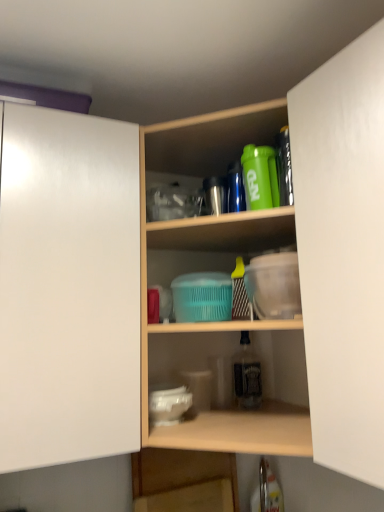
Describe the element at coordinates (213, 269) in the screenshot. I see `wooden shelves at center, the first shelf viewed from the top` at that location.

Image resolution: width=384 pixels, height=512 pixels. I want to click on clear glass bottle at center, which is the 2th bottle from front to back, so click(247, 375).

Image resolution: width=384 pixels, height=512 pixels. What do you see at coordinates (247, 375) in the screenshot?
I see `clear glass bottle at center, which is the 2th bottle from front to back` at bounding box center [247, 375].

This screenshot has height=512, width=384. I want to click on white matte cabinet door at left, marked as the 2th cabinetry in a right-to-left arrangement, so click(68, 288).

Is wooden shelves at center, marked as the second shelf in a bottom-to-top arrangement, placed right next to white matte cabinet door at left, positioned as the 1th cabinetry in left-to-right order?

No, wooden shelves at center, marked as the second shelf in a bottom-to-top arrangement, is not touching white matte cabinet door at left, positioned as the 1th cabinetry in left-to-right order.

From the image's perspective, is wooden shelves at center, marked as the second shelf in a bottom-to-top arrangement, located above or below white matte cabinet door at left, positioned as the 1th cabinetry in left-to-right order?

From the image's perspective, wooden shelves at center, marked as the second shelf in a bottom-to-top arrangement, appears below white matte cabinet door at left, positioned as the 1th cabinetry in left-to-right order.

Considering the sizes of objects wooden shelves at center, the first shelf viewed from the top, and white matte cabinet door at left, positioned as the 1th cabinetry in left-to-right order, in the image provided, who is thinner, wooden shelves at center, the first shelf viewed from the top, or white matte cabinet door at left, positioned as the 1th cabinetry in left-to-right order,?

white matte cabinet door at left, positioned as the 1th cabinetry in left-to-right order.

Is wooden shelves at center, the first shelf viewed from the top, positioned behind white matte cabinet door at left, positioned as the 1th cabinetry in left-to-right order?

Yes, wooden shelves at center, the first shelf viewed from the top, is further from the viewer.

Is white matte cabinet door at left, marked as the 2th cabinetry in a right-to-left arrangement, bigger or smaller than clear glass bottle at center, the 2th bottle viewed from the top?

Considering their sizes, white matte cabinet door at left, marked as the 2th cabinetry in a right-to-left arrangement, takes up more space than clear glass bottle at center, the 2th bottle viewed from the top.

From a real-world perspective, is white matte cabinet door at left, marked as the 2th cabinetry in a right-to-left arrangement, located beneath clear glass bottle at center, marked as the 1th bottle in a bottom-to-top arrangement?

Actually, white matte cabinet door at left, marked as the 2th cabinetry in a right-to-left arrangement, is physically above clear glass bottle at center, marked as the 1th bottle in a bottom-to-top arrangement, in the real world.

Could you tell me if white matte cabinet door at left, marked as the 2th cabinetry in a right-to-left arrangement, is turned towards clear glass bottle at center, which is counted as the first bottle, starting from the back?

No, white matte cabinet door at left, marked as the 2th cabinetry in a right-to-left arrangement, is not oriented towards clear glass bottle at center, which is counted as the first bottle, starting from the back.

In the image, is white matte cabinet door at left, marked as the 2th cabinetry in a right-to-left arrangement, positioned in front of or behind clear glass bottle at center, which is the 2th bottle from front to back?

Clearly, white matte cabinet door at left, marked as the 2th cabinetry in a right-to-left arrangement, is in front of clear glass bottle at center, which is the 2th bottle from front to back.

Is wooden shelves at center, the first shelf viewed from the top, wider or thinner than wooden shelf at lower center, positioned as the 1th shelf in bottom-to-top order?

Clearly, wooden shelves at center, the first shelf viewed from the top, has more width compared to wooden shelf at lower center, positioned as the 1th shelf in bottom-to-top order.

Is wooden shelves at center, the first shelf viewed from the top, at the right side of wooden shelf at lower center, positioned as the 1th shelf in bottom-to-top order?

Correct, you'll find wooden shelves at center, the first shelf viewed from the top, to the right of wooden shelf at lower center, positioned as the 1th shelf in bottom-to-top order.

Is wooden shelves at center, marked as the second shelf in a bottom-to-top arrangement, not within wooden shelf at lower center, the second shelf viewed from the top?

Yes.

Is wooden shelves at center, the first shelf viewed from the top, oriented away from wooden shelf at lower center, positioned as the 1th shelf in bottom-to-top order?

No, wooden shelf at lower center, positioned as the 1th shelf in bottom-to-top order, is not at the back of wooden shelves at center, the first shelf viewed from the top.

In terms of size, does wooden shelf at lower center, positioned as the 1th shelf in bottom-to-top order, appear bigger or smaller than white matte cabinet door at right, acting as the second cabinetry starting from the left?

wooden shelf at lower center, positioned as the 1th shelf in bottom-to-top order, is smaller than white matte cabinet door at right, acting as the second cabinetry starting from the left.

In the scene shown: Between wooden shelf at lower center, positioned as the 1th shelf in bottom-to-top order, and white matte cabinet door at right, the first cabinetry viewed from the right, which one appears on the left side from the viewer's perspective?

Positioned to the left is wooden shelf at lower center, positioned as the 1th shelf in bottom-to-top order.

Are wooden shelf at lower center, positioned as the 1th shelf in bottom-to-top order, and white matte cabinet door at right, acting as the second cabinetry starting from the left, making contact?

No, wooden shelf at lower center, positioned as the 1th shelf in bottom-to-top order, is not touching white matte cabinet door at right, acting as the second cabinetry starting from the left.

From the image's perspective, is wooden shelf at lower center, positioned as the 1th shelf in bottom-to-top order, above or below white matte cabinet door at right, acting as the second cabinetry starting from the left?

Clearly, from the image's perspective, wooden shelf at lower center, positioned as the 1th shelf in bottom-to-top order, is below white matte cabinet door at right, acting as the second cabinetry starting from the left.

Which point is more forward, (x=252, y=391) or (x=26, y=128)?

The point (x=26, y=128) is closer to the camera.

Who is smaller, clear glass bottle at center, marked as the 1th bottle in a bottom-to-top arrangement, or white matte cabinet door at left, marked as the 2th cabinetry in a right-to-left arrangement?

Smaller between the two is clear glass bottle at center, marked as the 1th bottle in a bottom-to-top arrangement.

Is clear glass bottle at center, the 2th bottle viewed from the top, in front of or behind white matte cabinet door at left, positioned as the 1th cabinetry in left-to-right order, in the image?

clear glass bottle at center, the 2th bottle viewed from the top, is positioned farther from the viewer than white matte cabinet door at left, positioned as the 1th cabinetry in left-to-right order.

From a real-world perspective, is clear glass bottle at center, marked as the 1th bottle in a bottom-to-top arrangement, physically located above or below white matte cabinet door at left, positioned as the 1th cabinetry in left-to-right order?

Clearly, from a real-world perspective, clear glass bottle at center, marked as the 1th bottle in a bottom-to-top arrangement, is below white matte cabinet door at left, positioned as the 1th cabinetry in left-to-right order.

In the image, is clear glass bottle at center, marked as the 1th bottle in a bottom-to-top arrangement, on the left side or the right side of wooden shelves at center, the first shelf viewed from the top?

Based on their positions, clear glass bottle at center, marked as the 1th bottle in a bottom-to-top arrangement, is located to the right of wooden shelves at center, the first shelf viewed from the top.

How far apart are clear glass bottle at center, which is counted as the first bottle, starting from the back, and wooden shelves at center, the first shelf viewed from the top?

38.89 centimeters.

Which is farther, [246,405] or [204,132]?

The point [246,405] is farther from the camera.

Is the position of clear glass bottle at center, marked as the 1th bottle in a bottom-to-top arrangement, more distant than that of wooden shelves at center, marked as the second shelf in a bottom-to-top arrangement?

Yes, clear glass bottle at center, marked as the 1th bottle in a bottom-to-top arrangement, is behind wooden shelves at center, marked as the second shelf in a bottom-to-top arrangement.

Is wooden shelves at center, marked as the second shelf in a bottom-to-top arrangement, further to camera compared to white matte cabinet door at right, acting as the second cabinetry starting from the left?

Yes, it is.

Can you confirm if wooden shelves at center, marked as the second shelf in a bottom-to-top arrangement, is shorter than white matte cabinet door at right, acting as the second cabinetry starting from the left?

In fact, wooden shelves at center, marked as the second shelf in a bottom-to-top arrangement, may be taller than white matte cabinet door at right, acting as the second cabinetry starting from the left.

Looking at the image, does wooden shelves at center, the first shelf viewed from the top, seem bigger or smaller compared to white matte cabinet door at right, the first cabinetry viewed from the right?

Considering their sizes, wooden shelves at center, the first shelf viewed from the top, takes up more space than white matte cabinet door at right, the first cabinetry viewed from the right.

How different are the orientations of wooden shelves at center, marked as the second shelf in a bottom-to-top arrangement, and white matte cabinet door at right, acting as the second cabinetry starting from the left, in degrees?

The angular difference between wooden shelves at center, marked as the second shelf in a bottom-to-top arrangement, and white matte cabinet door at right, acting as the second cabinetry starting from the left, is 45 degrees.

I want to click on the 1st cabinetry in front of the wooden shelves at center, the first shelf viewed from the top, so click(x=68, y=288).

Where is `the 2nd bottle to the right of the white matte cabinet door at left, marked as the 2th cabinetry in a right-to-left arrangement, starting your count from the anchor`? Image resolution: width=384 pixels, height=512 pixels. the 2nd bottle to the right of the white matte cabinet door at left, marked as the 2th cabinetry in a right-to-left arrangement, starting your count from the anchor is located at coordinates [x=247, y=375].

Estimate the real-world distances between objects in this image. Which object is further from clear glass bottle at center, marked as the 1th bottle in a bottom-to-top arrangement, white matte cabinet door at left, marked as the 2th cabinetry in a right-to-left arrangement, or wooden shelf at lower center, the second shelf viewed from the top?

white matte cabinet door at left, marked as the 2th cabinetry in a right-to-left arrangement.

Considering their positions, is wooden shelves at center, marked as the second shelf in a bottom-to-top arrangement, positioned further to wooden shelf at lower center, the second shelf viewed from the top, than green matte shaker at upper center, which is the first bottle from top to bottom?

Among the two, green matte shaker at upper center, which is the first bottle from top to bottom, is located further to wooden shelf at lower center, the second shelf viewed from the top.

Which object lies nearer to the anchor point wooden shelves at center, marked as the second shelf in a bottom-to-top arrangement, clear glass bottle at center, marked as the 1th bottle in a bottom-to-top arrangement, or white matte cabinet door at right, the first cabinetry viewed from the right?

white matte cabinet door at right, the first cabinetry viewed from the right, is closer to wooden shelves at center, marked as the second shelf in a bottom-to-top arrangement.

Estimate the real-world distances between objects in this image. Which object is closer to wooden shelf at lower center, positioned as the 1th shelf in bottom-to-top order, green matte shaker at upper center, placed as the 2th bottle when sorted from back to front, or white matte cabinet door at right, the first cabinetry viewed from the right?

The object closer to wooden shelf at lower center, positioned as the 1th shelf in bottom-to-top order, is white matte cabinet door at right, the first cabinetry viewed from the right.

From the image, which object appears to be farther from white matte cabinet door at left, marked as the 2th cabinetry in a right-to-left arrangement, clear glass bottle at center, marked as the 1th bottle in a bottom-to-top arrangement, or green matte shaker at upper center, placed as the 2th bottle when sorted from back to front?

clear glass bottle at center, marked as the 1th bottle in a bottom-to-top arrangement, is further to white matte cabinet door at left, marked as the 2th cabinetry in a right-to-left arrangement.

Which object lies nearer to the anchor point white matte cabinet door at right, the first cabinetry viewed from the right, wooden shelf at lower center, positioned as the 1th shelf in bottom-to-top order, or green matte shaker at upper center, the 2th bottle when ordered from bottom to top?

green matte shaker at upper center, the 2th bottle when ordered from bottom to top, is positioned closer to the anchor white matte cabinet door at right, the first cabinetry viewed from the right.

When comparing their distances from wooden shelf at lower center, positioned as the 1th shelf in bottom-to-top order, does white matte cabinet door at right, the first cabinetry viewed from the right, or wooden shelves at center, the first shelf viewed from the top, seem closer?

wooden shelves at center, the first shelf viewed from the top, is closer to wooden shelf at lower center, positioned as the 1th shelf in bottom-to-top order.

Considering their positions, is wooden shelves at center, marked as the second shelf in a bottom-to-top arrangement, positioned closer to white matte cabinet door at right, acting as the second cabinetry starting from the left, than green matte shaker at upper center, placed as the 2th bottle when sorted from back to front?

Based on the image, green matte shaker at upper center, placed as the 2th bottle when sorted from back to front, appears to be nearer to white matte cabinet door at right, acting as the second cabinetry starting from the left.

This screenshot has width=384, height=512. I want to click on bottle between white matte cabinet door at right, the first cabinetry viewed from the right, and clear glass bottle at center, which is the 2th bottle from front to back, in the front-back direction, so click(x=260, y=177).

Where is `shelf between white matte cabinet door at right, the first cabinetry viewed from the right, and green matte shaker at upper center, the 2th bottle when ordered from bottom to top, from front to back`? The height and width of the screenshot is (512, 384). shelf between white matte cabinet door at right, the first cabinetry viewed from the right, and green matte shaker at upper center, the 2th bottle when ordered from bottom to top, from front to back is located at coordinates (213, 269).

At what (x,y) coordinates should I click in order to perform the action: click on bottle situated between white matte cabinet door at left, positioned as the 1th cabinetry in left-to-right order, and clear glass bottle at center, which is the 2th bottle from front to back, from left to right. Please return your answer as a coordinate pair (x, y). Image resolution: width=384 pixels, height=512 pixels. Looking at the image, I should click on (260, 177).

Locate an element on the screen. The image size is (384, 512). shelf between white matte cabinet door at right, the first cabinetry viewed from the right, and wooden shelf at lower center, the second shelf viewed from the top, in the vertical direction is located at coordinates (213, 269).